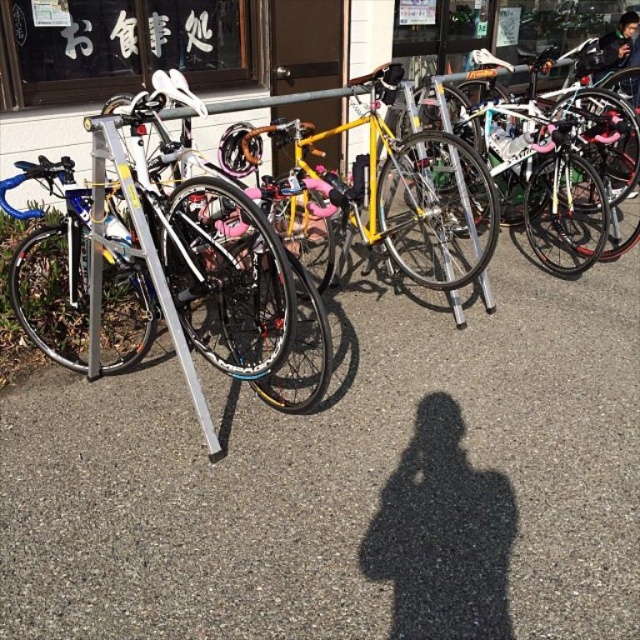
You are standing at the point marked as point (348, 481) in the image. What material are you standing on?

The point (348, 481) corresponds to matte asphalt pavement at center, so you are standing on asphalt.

You are a photographer standing at an angle to capture the scene. You notice your shadow on the matte asphalt pavement at center. If you want to avoid casting a shadow on the shiny silver bicycle at center, should you move your camera position forward or backward?

The matte asphalt pavement at center is below the shiny silver bicycle at center. To avoid casting a shadow on the bicycle, you should move your camera position backward so that your shadow falls on the pavement but does not reach the bicycle.

You are a photographer standing at an angle to take a photo of the bicycles. You notice the matte asphalt pavement at center and the yellow matte bicycle at center. Which one has a greater width in the photo?

The matte asphalt pavement at center has a greater width than the yellow matte bicycle at center in the photo.